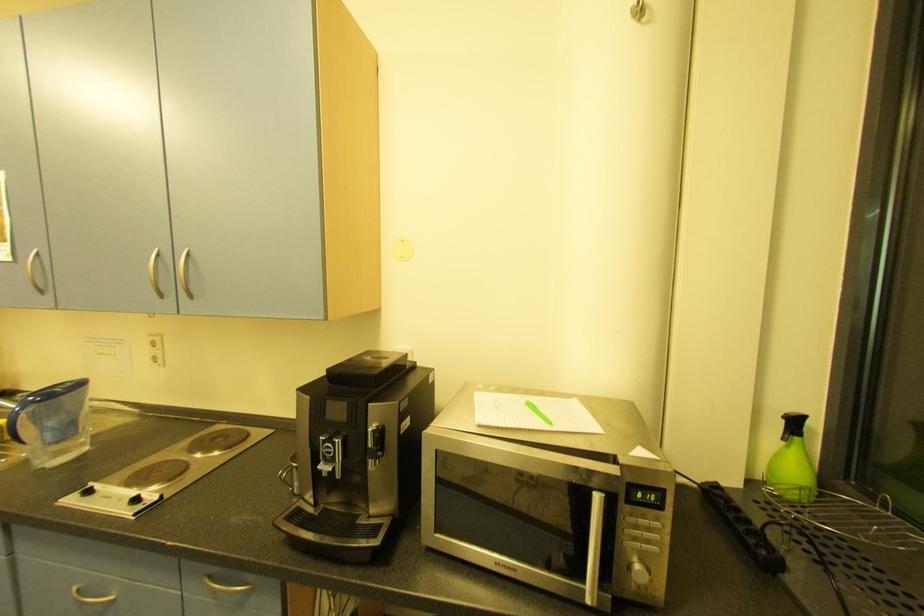
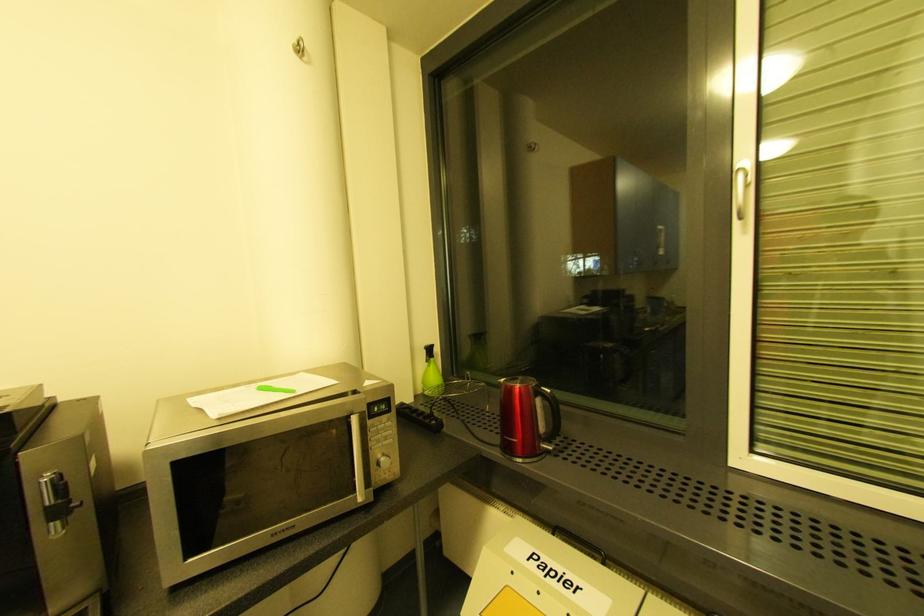
Question: The images are taken continuously from a first-person perspective. In which direction is your viewpoint rotating?

Choices:
 (A) Left
 (B) Right
 (C) Up
 (D) Down

Answer: (B)